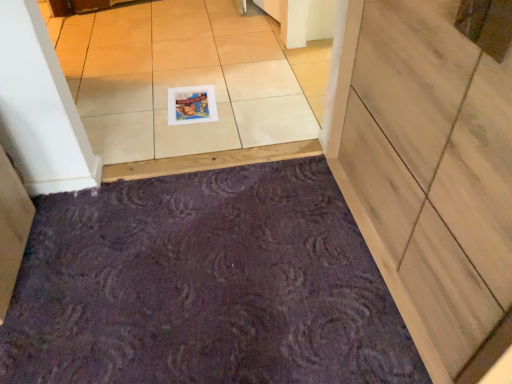
Question: Does wooden door at lower right have a lesser height compared to matte plastic postcard at center?

Choices:
 (A) no
 (B) yes

Answer: (A)

Question: Does wooden door at lower right turn towards matte plastic postcard at center?

Choices:
 (A) no
 (B) yes

Answer: (A)

Question: Does wooden door at lower right have a larger size compared to matte plastic postcard at center?

Choices:
 (A) yes
 (B) no

Answer: (A)

Question: From a real-world perspective, is wooden door at lower right on top of matte plastic postcard at center?

Choices:
 (A) no
 (B) yes

Answer: (B)

Question: Are wooden door at lower right and matte plastic postcard at center located far from each other?

Choices:
 (A) no
 (B) yes

Answer: (A)

Question: From the image's perspective, is wooden door at lower right positioned above or below matte plastic postcard at center?

Choices:
 (A) above
 (B) below

Answer: (B)

Question: Based on their positions, is wooden door at lower right located to the left or right of matte plastic postcard at center?

Choices:
 (A) right
 (B) left

Answer: (A)

Question: In terms of width, does wooden door at lower right look wider or thinner when compared to matte plastic postcard at center?

Choices:
 (A) wide
 (B) thin

Answer: (A)

Question: Considering the positions of wooden door at lower right and matte plastic postcard at center in the image, is wooden door at lower right taller or shorter than matte plastic postcard at center?

Choices:
 (A) short
 (B) tall

Answer: (B)

Question: Is matte plastic postcard at center wider or thinner than white glossy tile at upper center?

Choices:
 (A) thin
 (B) wide

Answer: (A)

Question: Considering their positions, is matte plastic postcard at center located in front of or behind white glossy tile at upper center?

Choices:
 (A) front
 (B) behind

Answer: (B)

Question: Considering the positions of matte plastic postcard at center and white glossy tile at upper center in the image, is matte plastic postcard at center taller or shorter than white glossy tile at upper center?

Choices:
 (A) short
 (B) tall

Answer: (B)

Question: From a real-world perspective, is matte plastic postcard at center physically located above or below white glossy tile at upper center?

Choices:
 (A) below
 (B) above

Answer: (A)

Question: From a real-world perspective, is wooden door at lower right above or below purple textured bath mat at lower center?

Choices:
 (A) below
 (B) above

Answer: (B)

Question: Does point (x=495, y=309) appear closer or farther from the camera than point (x=237, y=334)?

Choices:
 (A) farther
 (B) closer

Answer: (B)